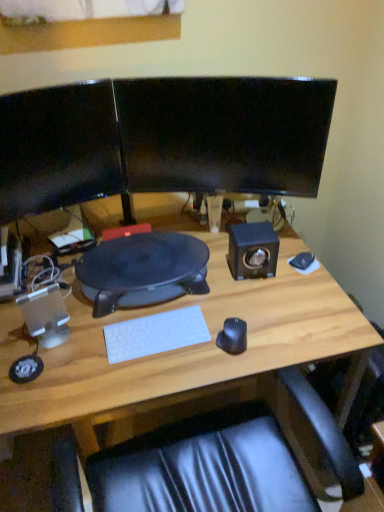
I want to click on vacant space behind white matte keyboard at center, so click(x=171, y=302).